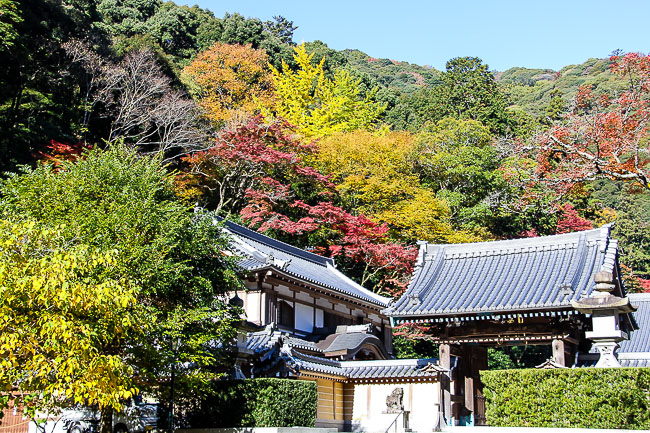
Locate an element on the screen. This screenshot has width=650, height=433. decorative piece is located at coordinates (398, 400).